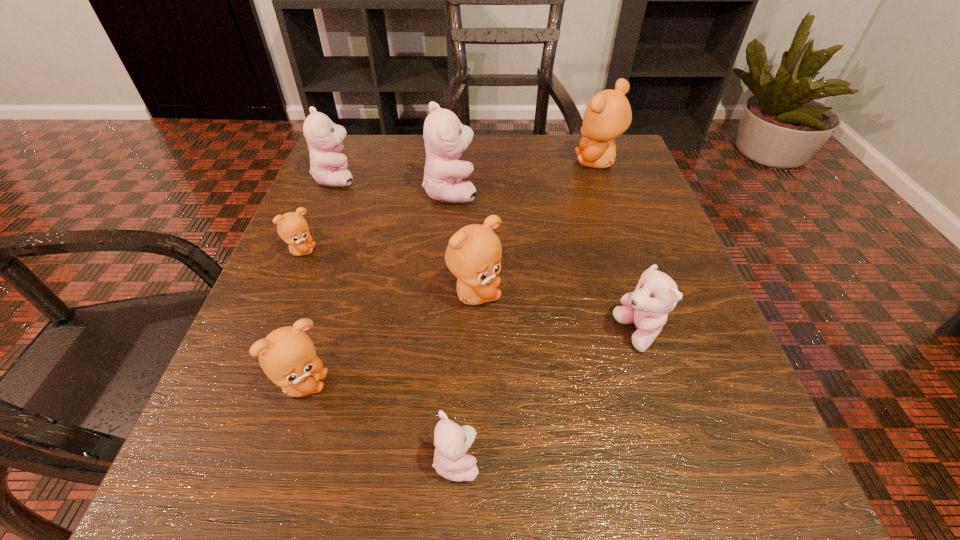
You are a GUI agent. You are given a task and a screenshot of the screen. Output one action in this format:
    pyautogui.click(x=<x>, y=<y>)
    Task: Click on the biggest pink teddy bear
    Image resolution: width=960 pixels, height=540 pixels.
    Given the screenshot: What is the action you would take?
    pyautogui.click(x=445, y=137)

Identify the location of the farthest brown teddy bear. The height and width of the screenshot is (540, 960). 608,114.

Where is `the rightmost brown teddy bear`? The image size is (960, 540). the rightmost brown teddy bear is located at coordinates (608, 114).

Identify the location of the third smallest pink teddy bear. (328, 166).

At what (x,y) coordinates should I click in order to perform the action: click on the second nearest brown teddy bear. Please return your answer as a coordinate pair (x, y). Image resolution: width=960 pixels, height=540 pixels. Looking at the image, I should click on [473, 255].

This screenshot has height=540, width=960. Find the location of `the third brown teddy bear from left to right`. the third brown teddy bear from left to right is located at coordinates (473, 255).

Where is `the second brown teddy bear from left to right`? the second brown teddy bear from left to right is located at coordinates (287, 355).

This screenshot has height=540, width=960. I want to click on the second nearest teddy bear, so click(287, 355).

At what (x,y) coordinates should I click in order to perform the action: click on the rightmost pink teddy bear. Please return your answer as a coordinate pair (x, y). Looking at the image, I should click on (656, 294).

Identify the location of the third biggest pink teddy bear. The height and width of the screenshot is (540, 960). (656, 294).